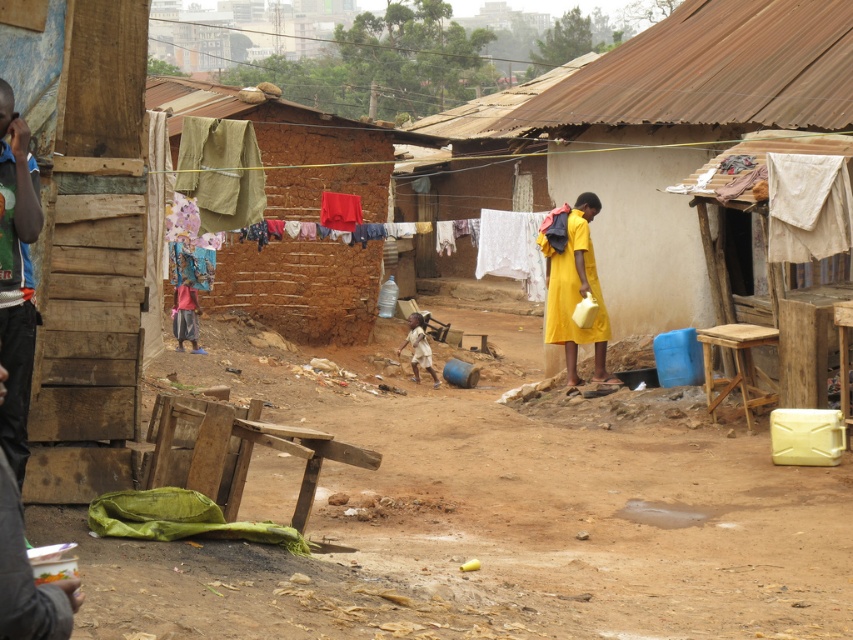
You are a photographer capturing this scene. You notice the wooden planks at left and the yellow matte dress at center. Which object is positioned lower in the image?

The wooden planks at left are positioned lower in the image than the yellow matte dress at center because the wooden planks at left is located below yellow matte dress at center.

You are a delivery person trying to place a small package on the wooden planks at left and the light brown fabric shirt at center. Which surface can accommodate the package more easily?

The light brown fabric shirt at center has a greater width than the wooden planks at left, so it can accommodate the package more easily.